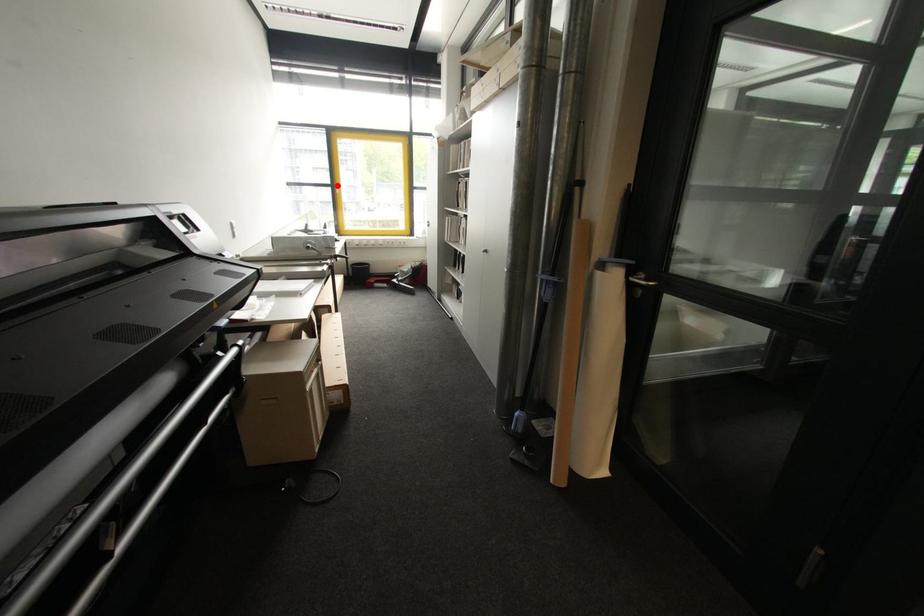
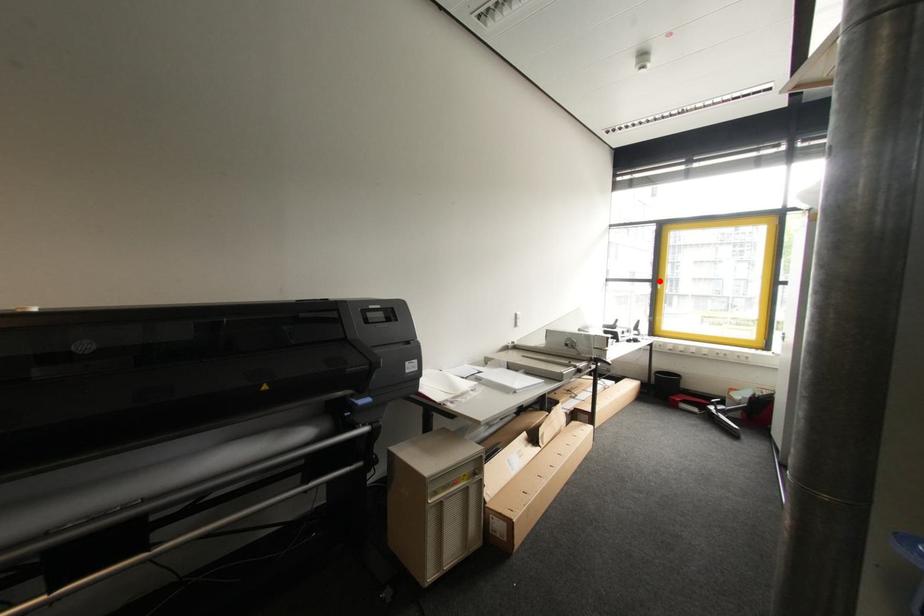
I am providing you with two images of the same scene from different viewpoints. A red point is marked on the first image and another point is marked on the second image. Do the highlighted points in image1 and image2 indicate the same real-world spot?

Yes